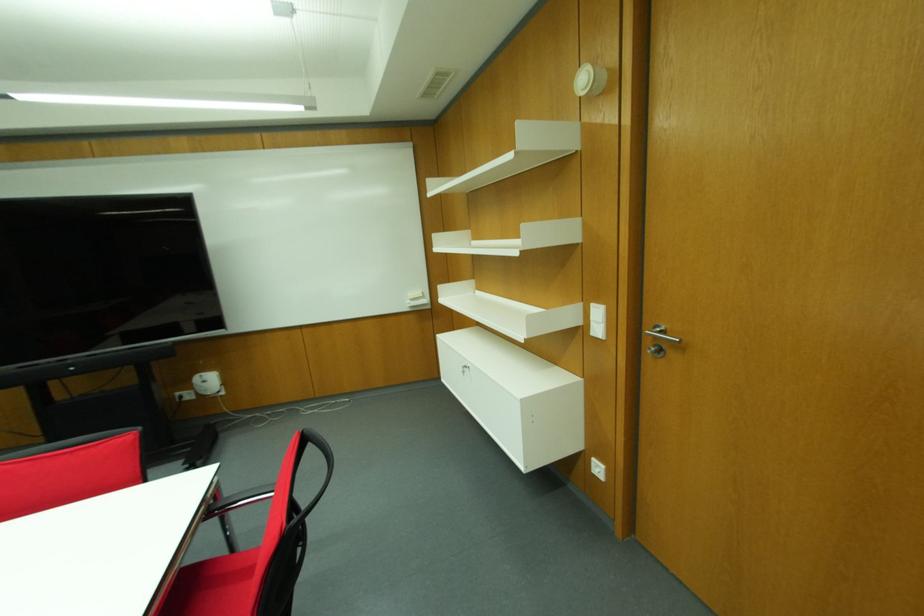
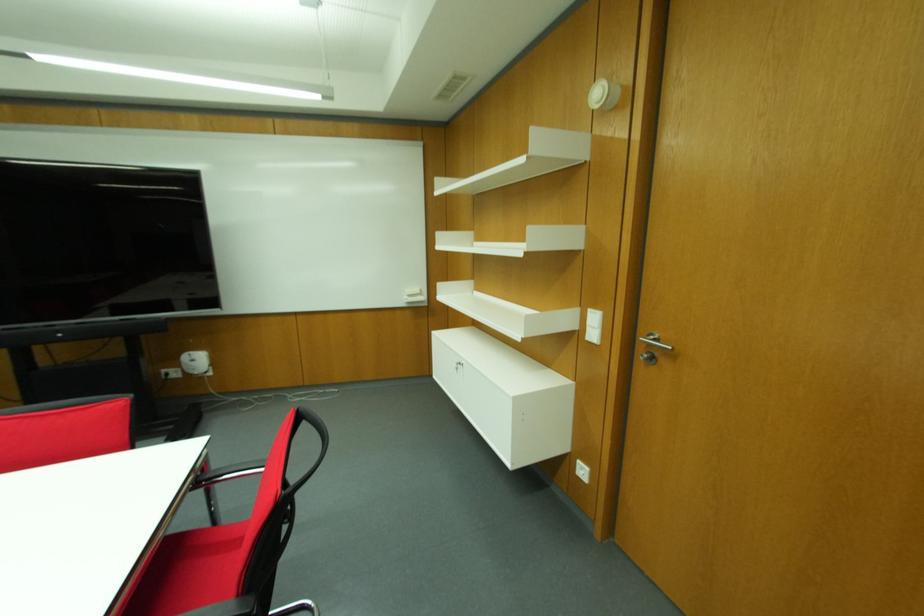
The point at (x=591, y=305) is marked in the first image. Where is the corresponding point in the second image?

(589, 310)